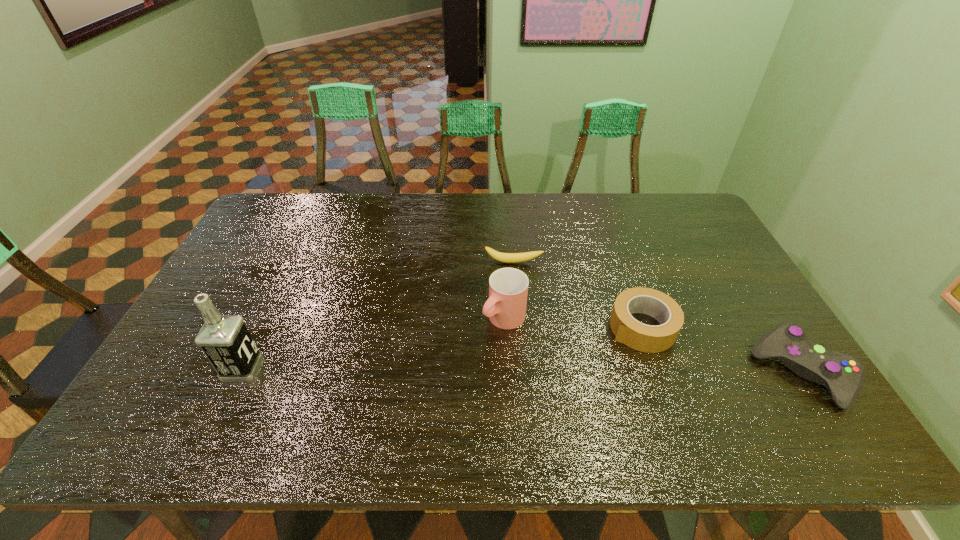
The width and height of the screenshot is (960, 540). I want to click on the tallest object, so click(x=225, y=340).

In order to click on the leftmost object in this screenshot , I will do `click(225, 340)`.

The image size is (960, 540). What are the coordinates of `the third shortest object` in the screenshot? It's located at (843, 374).

Identify the location of control. (843, 374).

Find the location of `the fourth object from left to right`. the fourth object from left to right is located at coordinates (646, 338).

Identify the location of the farthest object. (499, 256).

Identify the location of cup. (508, 287).

The width and height of the screenshot is (960, 540). I want to click on vacant area situated 0.140m on the front label of the leftmost object, so click(315, 368).

You are a GUI agent. You are given a task and a screenshot of the screen. Output one action in this format:
    pyautogui.click(x=<x>, y=<y>)
    Task: Click on the vacant space located on the back of the rightmost object
    
    Given the screenshot: What is the action you would take?
    pyautogui.click(x=723, y=248)

This screenshot has height=540, width=960. Find the location of `vacant region located 0.170m at the edge of the duct tape`. vacant region located 0.170m at the edge of the duct tape is located at coordinates (572, 372).